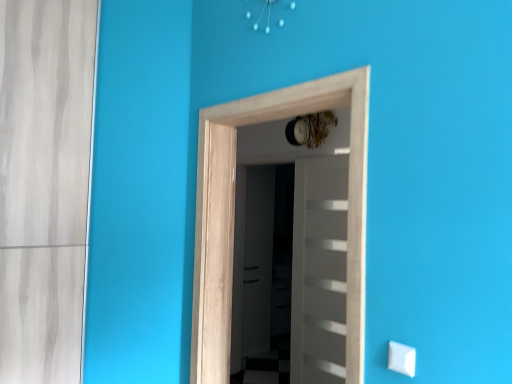
Question: In which direction should I rotate to look at natural wood door at center, the 2th door when ordered from back to front?

Choices:
 (A) right
 (B) left

Answer: (A)

Question: Would you say natural wood door at center, the 2th door when ordered from back to front, is outside transparent glass screen door at center?

Choices:
 (A) yes
 (B) no

Answer: (A)

Question: From the image's perspective, does natural wood door at center, the 2th door when ordered from back to front, appear lower than transparent glass screen door at center?

Choices:
 (A) no
 (B) yes

Answer: (A)

Question: From the image's perspective, is natural wood door at center, the 2th door when ordered from back to front, on transparent glass screen door at center?

Choices:
 (A) no
 (B) yes

Answer: (B)

Question: Considering the relative sizes of natural wood door at center, the 2th door when ordered from back to front, and transparent glass screen door at center in the image provided, is natural wood door at center, the 2th door when ordered from back to front, smaller than transparent glass screen door at center?

Choices:
 (A) yes
 (B) no

Answer: (A)

Question: Is natural wood door at center, the 2th door when ordered from back to front, aimed at transparent glass screen door at center?

Choices:
 (A) no
 (B) yes

Answer: (A)

Question: From a real-world perspective, is natural wood door at center, the 2th door when ordered from back to front, over transparent glass screen door at center?

Choices:
 (A) no
 (B) yes

Answer: (B)

Question: Does natural wood door at center, which ranks as the first door in front-to-back order, have a lesser width compared to white plastic light switch at lower right?

Choices:
 (A) no
 (B) yes

Answer: (A)

Question: From the image's perspective, would you say natural wood door at center, the 2th door when ordered from back to front, is positioned over white plastic light switch at lower right?

Choices:
 (A) no
 (B) yes

Answer: (B)

Question: Is natural wood door at center, which ranks as the first door in front-to-back order, at the right side of white plastic light switch at lower right?

Choices:
 (A) yes
 (B) no

Answer: (B)

Question: Does natural wood door at center, the 2th door when ordered from back to front, have a greater height compared to white plastic light switch at lower right?

Choices:
 (A) no
 (B) yes

Answer: (B)

Question: Considering the relative sizes of natural wood door at center, the 2th door when ordered from back to front, and white plastic light switch at lower right in the image provided, is natural wood door at center, the 2th door when ordered from back to front, wider than white plastic light switch at lower right?

Choices:
 (A) yes
 (B) no

Answer: (A)

Question: Is natural wood door at center, which ranks as the first door in front-to-back order, further to the viewer compared to white plastic light switch at lower right?

Choices:
 (A) yes
 (B) no

Answer: (A)

Question: Can we say white glossy door at center, acting as the second door starting from the front, lies outside natural wood door at center, the 2th door when ordered from back to front?

Choices:
 (A) yes
 (B) no

Answer: (A)